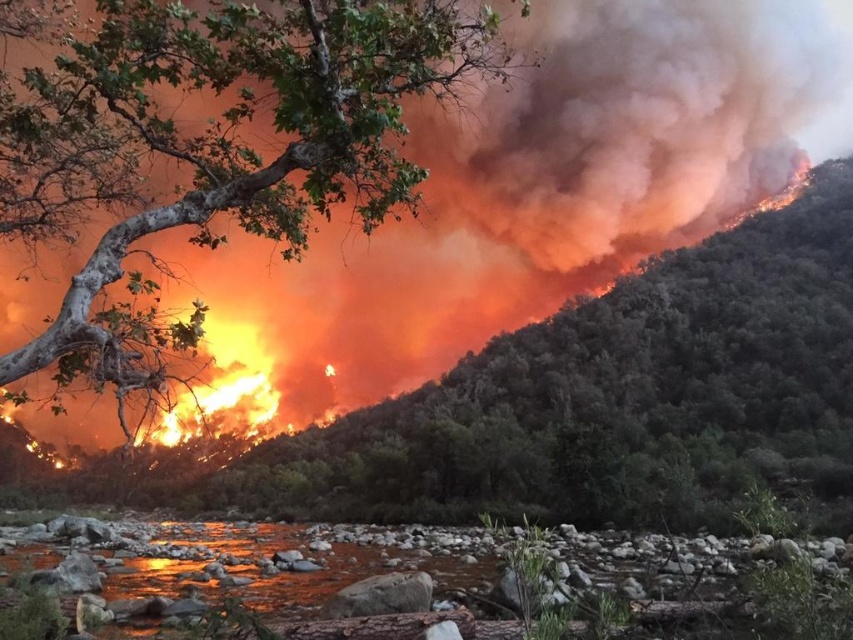
Consider the image. Can you confirm if green leafy tree at center is bigger than green leafy tree at upper left?

Yes, green leafy tree at center is bigger than green leafy tree at upper left.

Between green leafy tree at center and green leafy tree at upper left, which one has less height?

With less height is green leafy tree at upper left.

Where is `green leafy tree at center`? The height and width of the screenshot is (640, 853). green leafy tree at center is located at coordinates (572, 403).